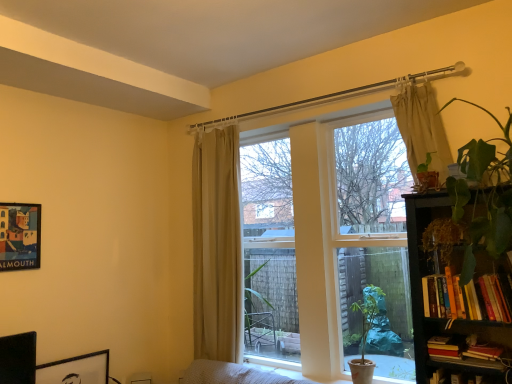
Question: Is hardcover books at lower right, which is the third book from bottom to top, surrounded by black matte picture frame at lower left, the second picture frame from the left?

Choices:
 (A) yes
 (B) no

Answer: (B)

Question: From the image's perspective, is black matte picture frame at lower left, the second picture frame positioned from the top, on top of hardcover books at lower right, which is the 2th book in top-to-bottom order?

Choices:
 (A) no
 (B) yes

Answer: (A)

Question: Is black matte picture frame at lower left, which is the first picture frame in bottom-to-top order, closer to camera compared to hardcover books at lower right, which is the 2th book in top-to-bottom order?

Choices:
 (A) no
 (B) yes

Answer: (A)

Question: Does black matte picture frame at lower left, the second picture frame from the left, appear on the right side of hardcover books at lower right, which is the 2th book in top-to-bottom order?

Choices:
 (A) no
 (B) yes

Answer: (A)

Question: Is black matte picture frame at lower left, which is the first picture frame in bottom-to-top order, not inside hardcover books at lower right, which is the 2th book in top-to-bottom order?

Choices:
 (A) yes
 (B) no

Answer: (A)

Question: From the image's perspective, is black matte picture frame at lower left, the second picture frame positioned from the top, located above or below hardcover books at lower right, which is the third book from bottom to top?

Choices:
 (A) above
 (B) below

Answer: (B)

Question: Choose the correct answer: Is black matte picture frame at lower left, the second picture frame positioned from the top, inside hardcover books at lower right, which is the third book from bottom to top, or outside it?

Choices:
 (A) outside
 (B) inside

Answer: (A)

Question: From a real-world perspective, is black matte picture frame at lower left, which is the first picture frame in bottom-to-top order, above or below hardcover books at lower right, which is the 2th book in top-to-bottom order?

Choices:
 (A) below
 (B) above

Answer: (A)

Question: In the image, is black matte picture frame at lower left, marked as the first picture frame in a right-to-left arrangement, on the left side or the right side of hardcover books at lower right, which is the third book from bottom to top?

Choices:
 (A) right
 (B) left

Answer: (B)

Question: Is point (33, 231) positioned closer to the camera than point (436, 122)?

Choices:
 (A) closer
 (B) farther

Answer: (B)

Question: In terms of width, does matte paper picture frame at upper left, positioned as the first picture frame in top-to-bottom order, look wider or thinner when compared to beige fabric curtain at upper right, the 2th curtain when ordered from left to right?

Choices:
 (A) wide
 (B) thin

Answer: (B)

Question: Looking at the image, does matte paper picture frame at upper left, positioned as the first picture frame in top-to-bottom order, seem bigger or smaller compared to beige fabric curtain at upper right, acting as the first curtain starting from the front?

Choices:
 (A) big
 (B) small

Answer: (B)

Question: Do you think matte paper picture frame at upper left, which is the 1th picture frame from left to right, is within beige fabric curtain at upper right, the 2th curtain viewed from the back, or outside of it?

Choices:
 (A) outside
 (B) inside

Answer: (A)

Question: From a real-world perspective, is black matte picture frame at lower left, marked as the first picture frame in a right-to-left arrangement, positioned above or below matte paper picture frame at upper left, positioned as the first picture frame in top-to-bottom order?

Choices:
 (A) above
 (B) below

Answer: (B)

Question: In the image, is black matte picture frame at lower left, marked as the first picture frame in a right-to-left arrangement, positioned in front of or behind matte paper picture frame at upper left, the second picture frame from the right?

Choices:
 (A) behind
 (B) front

Answer: (A)